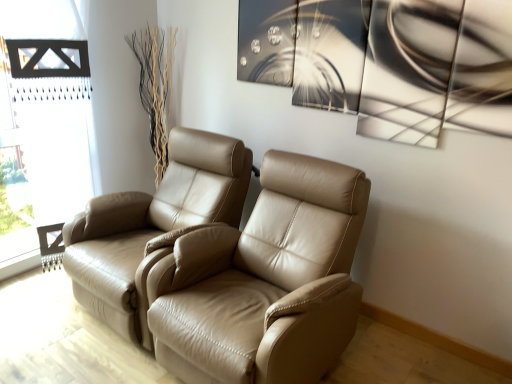
Question: Do you think tan leather recliner at center, the first chair positioned from the right, is within black wooden frame at left, or outside of it?

Choices:
 (A) outside
 (B) inside

Answer: (A)

Question: From a real-world perspective, is tan leather recliner at center, the first chair positioned from the right, positioned above or below black wooden frame at left?

Choices:
 (A) above
 (B) below

Answer: (B)

Question: Considering the real-world distances, which object is farthest from the tan leather chair at left, the first chair in the left-to-right sequence?

Choices:
 (A) tan leather recliner at center, the first chair positioned from the right
 (B) black wooden frame at left

Answer: (B)

Question: Which object is positioned farthest from the tan leather chair at left, the first chair in the left-to-right sequence?

Choices:
 (A) black wooden frame at left
 (B) tan leather recliner at center, acting as the 2th chair starting from the left

Answer: (A)